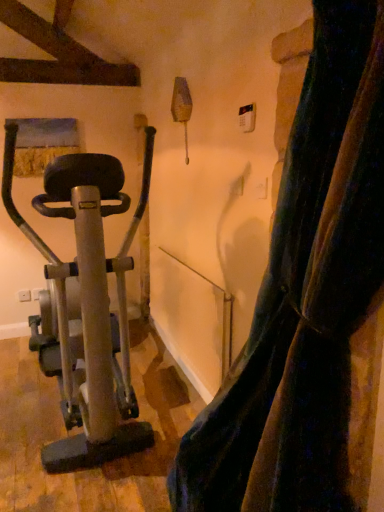
The image size is (384, 512). What do you see at coordinates (309, 303) in the screenshot?
I see `velvet dark blue curtain at right` at bounding box center [309, 303].

Locate an element on the screen. The height and width of the screenshot is (512, 384). velvet dark blue curtain at right is located at coordinates (309, 303).

This screenshot has height=512, width=384. What do you see at coordinates (89, 302) in the screenshot?
I see `silver metallic stationary bicycle at left` at bounding box center [89, 302].

What is the approximate width of silver metallic stationary bicycle at left?

75.25 centimeters.

I want to click on silver metallic stationary bicycle at left, so click(x=89, y=302).

At what (x,y) coordinates should I click in order to perform the action: click on velvet dark blue curtain at right. Please return your answer as a coordinate pair (x, y). This screenshot has height=512, width=384. Looking at the image, I should click on (309, 303).

Based on the photo, would you say velvet dark blue curtain at right is to the left or to the right of silver metallic stationary bicycle at left in the picture?

From the image, it's evident that velvet dark blue curtain at right is to the right of silver metallic stationary bicycle at left.

Based on the photo, is the depth of velvet dark blue curtain at right less than that of silver metallic stationary bicycle at left?

That is True.

Which is nearer, (x=368, y=435) or (x=81, y=266)?

Point (x=368, y=435) appears to be closer to the viewer than point (x=81, y=266).

From the image's perspective, is velvet dark blue curtain at right under silver metallic stationary bicycle at left?

Yes, from the image's perspective, velvet dark blue curtain at right is beneath silver metallic stationary bicycle at left.

From the picture: From a real-world perspective, is velvet dark blue curtain at right positioned under silver metallic stationary bicycle at left based on gravity?

No, from a real-world perspective, velvet dark blue curtain at right is not under silver metallic stationary bicycle at left.

Does velvet dark blue curtain at right have a lesser width compared to silver metallic stationary bicycle at left?

Correct, the width of velvet dark blue curtain at right is less than that of silver metallic stationary bicycle at left.

Considering the relative sizes of velvet dark blue curtain at right and silver metallic stationary bicycle at left in the image provided, is velvet dark blue curtain at right taller than silver metallic stationary bicycle at left?

Yes.

Which of these two, velvet dark blue curtain at right or silver metallic stationary bicycle at left, is smaller?

velvet dark blue curtain at right.

Would you say velvet dark blue curtain at right is inside or outside silver metallic stationary bicycle at left?

velvet dark blue curtain at right is located beyond the bounds of silver metallic stationary bicycle at left.

Is velvet dark blue curtain at right far from silver metallic stationary bicycle at left?

No, velvet dark blue curtain at right is in close proximity to silver metallic stationary bicycle at left.

Looking at this image, is velvet dark blue curtain at right positioned with its back to silver metallic stationary bicycle at left?

No.

Can you tell me how much velvet dark blue curtain at right and silver metallic stationary bicycle at left differ in facing direction?

The angle between the facing direction of velvet dark blue curtain at right and the facing direction of silver metallic stationary bicycle at left is 0.199 degrees.

Measure the distance from velvet dark blue curtain at right to silver metallic stationary bicycle at left.

The distance of velvet dark blue curtain at right from silver metallic stationary bicycle at left is 33.01 inches.

Where is `stationary bicycle located above the velvet dark blue curtain at right (from the image's perspective)`? The width and height of the screenshot is (384, 512). stationary bicycle located above the velvet dark blue curtain at right (from the image's perspective) is located at coordinates (89, 302).

Between silver metallic stationary bicycle at left and velvet dark blue curtain at right, which one appears on the left side from the viewer's perspective?

silver metallic stationary bicycle at left is more to the left.

Which object is closer to the camera taking this photo, silver metallic stationary bicycle at left or velvet dark blue curtain at right?

velvet dark blue curtain at right is more forward.

Which is farther, (126, 413) or (320, 419)?

Positioned behind is point (126, 413).

From the image's perspective, is silver metallic stationary bicycle at left above or below velvet dark blue curtain at right?

silver metallic stationary bicycle at left is situated higher than velvet dark blue curtain at right in the image.

From a real-world perspective, is silver metallic stationary bicycle at left physically located above or below velvet dark blue curtain at right?

In terms of real-world spatial position, silver metallic stationary bicycle at left is below velvet dark blue curtain at right.

Does silver metallic stationary bicycle at left have a lesser width compared to velvet dark blue curtain at right?

Incorrect, the width of silver metallic stationary bicycle at left is not less than that of velvet dark blue curtain at right.

Considering the sizes of objects silver metallic stationary bicycle at left and velvet dark blue curtain at right in the image provided, who is taller, silver metallic stationary bicycle at left or velvet dark blue curtain at right?

velvet dark blue curtain at right is taller.

Is silver metallic stationary bicycle at left smaller than velvet dark blue curtain at right?

No, silver metallic stationary bicycle at left is not smaller than velvet dark blue curtain at right.

Is velvet dark blue curtain at right located within silver metallic stationary bicycle at left?

Definitely not — velvet dark blue curtain at right is not inside silver metallic stationary bicycle at left.

Are silver metallic stationary bicycle at left and velvet dark blue curtain at right located far from each other?

They are positioned close to each other.

Based on the photo, could you tell me if silver metallic stationary bicycle at left is turned towards velvet dark blue curtain at right?

No.

At what (x,y) coordinates should I click in order to perform the action: click on stationary bicycle directly beneath the velvet dark blue curtain at right (from a real-world perspective). Please return your answer as a coordinate pair (x, y). Looking at the image, I should click on (89, 302).

Find the location of `curtain above the silver metallic stationary bicycle at left (from a real-world perspective)`. curtain above the silver metallic stationary bicycle at left (from a real-world perspective) is located at coordinates (309, 303).

The width and height of the screenshot is (384, 512). Find the location of `stationary bicycle beneath the velvet dark blue curtain at right (from a real-world perspective)`. stationary bicycle beneath the velvet dark blue curtain at right (from a real-world perspective) is located at coordinates (89, 302).